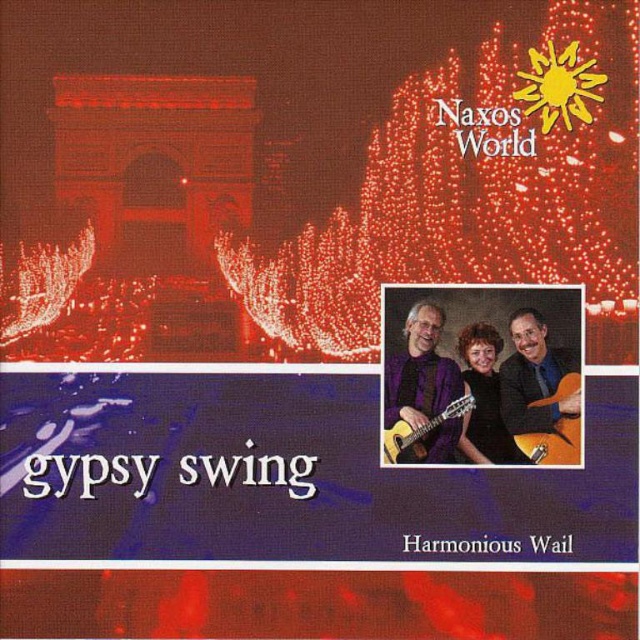
Question: Is the position of purple glossy guitar at center more distant than that of purple fabric guitar at center?

Choices:
 (A) no
 (B) yes

Answer: (B)

Question: Can you confirm if purple glossy guitar at center is positioned below light brown wooden guitar at center?

Choices:
 (A) yes
 (B) no

Answer: (A)

Question: Which object appears farthest from the camera in this image?

Choices:
 (A) purple fabric guitar at center
 (B) light brown wooden guitar at center
 (C) black glossy dress at center

Answer: (B)

Question: Considering the real-world distances, which object is closest to the orange wood guitar at center?

Choices:
 (A) matte black guitar at center
 (B) light brown wooden guitar at center
 (C) purple glossy guitar at center
 (D) purple fabric guitar at center

Answer: (A)

Question: From the image, what is the correct spatial relationship of purple glossy guitar at center in relation to light brown wooden guitar at center?

Choices:
 (A) right
 (B) left

Answer: (A)

Question: Which point is farther from the camera taking this photo?

Choices:
 (A) (422, 428)
 (B) (442, 369)
 (C) (470, 429)
 (D) (468, 340)

Answer: (B)